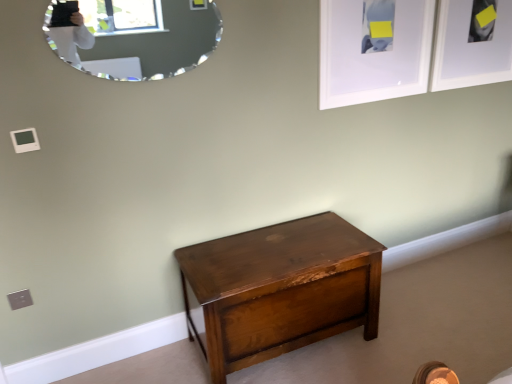
Question: Is the depth of shiny brown wood chest at center less than that of silver-framed mirror at upper left?

Choices:
 (A) yes
 (B) no

Answer: (B)

Question: Can you confirm if shiny brown wood chest at center is taller than silver-framed mirror at upper left?

Choices:
 (A) yes
 (B) no

Answer: (A)

Question: Is silver-framed mirror at upper left surrounded by shiny brown wood chest at center?

Choices:
 (A) no
 (B) yes

Answer: (A)

Question: Does shiny brown wood chest at center come behind silver-framed mirror at upper left?

Choices:
 (A) no
 (B) yes

Answer: (B)

Question: Is shiny brown wood chest at center outside silver-framed mirror at upper left?

Choices:
 (A) yes
 (B) no

Answer: (A)

Question: Considering the relative sizes of shiny brown wood chest at center and silver-framed mirror at upper left in the image provided, is shiny brown wood chest at center bigger than silver-framed mirror at upper left?

Choices:
 (A) no
 (B) yes

Answer: (B)

Question: From a real-world perspective, is white matte picture frame at upper right, positioned as the first picture frame in right-to-left order, located beneath white matte picture frame at upper right, the 1th picture frame positioned from the left?

Choices:
 (A) yes
 (B) no

Answer: (A)

Question: Does white matte picture frame at upper right, which appears as the 2th picture frame when viewed from the left, turn towards white matte picture frame at upper right, the 1th picture frame positioned from the left?

Choices:
 (A) yes
 (B) no

Answer: (B)

Question: Can you confirm if white matte picture frame at upper right, positioned as the first picture frame in right-to-left order, is thinner than white matte picture frame at upper right, the second picture frame when ordered from right to left?

Choices:
 (A) no
 (B) yes

Answer: (A)

Question: Is white matte picture frame at upper right, positioned as the first picture frame in right-to-left order, facing away from white matte picture frame at upper right, the 1th picture frame positioned from the left?

Choices:
 (A) yes
 (B) no

Answer: (B)

Question: Does white matte picture frame at upper right, positioned as the first picture frame in right-to-left order, have a smaller size compared to white matte picture frame at upper right, the second picture frame when ordered from right to left?

Choices:
 (A) yes
 (B) no

Answer: (B)

Question: Is white matte picture frame at upper right, which appears as the 2th picture frame when viewed from the left, wider than white matte picture frame at upper right, the 1th picture frame positioned from the left?

Choices:
 (A) yes
 (B) no

Answer: (A)

Question: From a real-world perspective, is white matte picture frame at upper right, the second picture frame when ordered from right to left, under white matte picture frame at upper right, which appears as the 2th picture frame when viewed from the left?

Choices:
 (A) no
 (B) yes

Answer: (A)